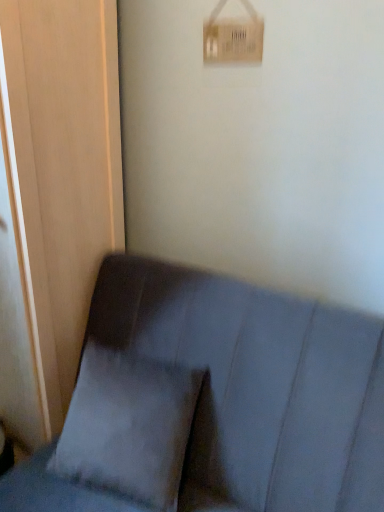
Image resolution: width=384 pixels, height=512 pixels. What do you see at coordinates (128, 426) in the screenshot?
I see `gray fabric pillow at lower left` at bounding box center [128, 426].

Where is `suede gray couch at lower left`? suede gray couch at lower left is located at coordinates (258, 386).

Identify the location of matte wood screen door at left. The height and width of the screenshot is (512, 384). (61, 170).

Image resolution: width=384 pixels, height=512 pixels. What do you see at coordinates (61, 170) in the screenshot? I see `matte wood screen door at left` at bounding box center [61, 170].

Identify the location of gray fabric pillow at lower left. (128, 426).

Is white cardboard light switch at upper center far away from matte wood screen door at left?

white cardboard light switch at upper center is actually quite close to matte wood screen door at left.

Identify the location of screen door below the white cardboard light switch at upper center (from the image's perspective). This screenshot has width=384, height=512. (61, 170).

Which object is closer to the camera, white cardboard light switch at upper center or matte wood screen door at left?

matte wood screen door at left is closer to the camera.

Does point (243, 35) come closer to viewer compared to point (24, 198)?

No, (243, 35) is further to viewer.

Is matte wood screen door at left wider than suede gray couch at lower left?

In fact, matte wood screen door at left might be narrower than suede gray couch at lower left.

Considering the sizes of objects matte wood screen door at left and suede gray couch at lower left in the image provided, who is taller, matte wood screen door at left or suede gray couch at lower left?

With more height is matte wood screen door at left.

Image resolution: width=384 pixels, height=512 pixels. In order to click on screen door above the suede gray couch at lower left (from a real-world perspective) in this screenshot , I will do `click(61, 170)`.

From the image's perspective, relative to suede gray couch at lower left, is matte wood screen door at left above or below?

matte wood screen door at left is above suede gray couch at lower left.

Is white cardboard light switch at upper center wider or thinner than gray fabric pillow at lower left?

In the image, white cardboard light switch at upper center appears to be more narrow than gray fabric pillow at lower left.

Is white cardboard light switch at upper center far away from gray fabric pillow at lower left?

white cardboard light switch at upper center is positioned a significant distance from gray fabric pillow at lower left.

How different are the orientations of white cardboard light switch at upper center and gray fabric pillow at lower left in degrees?

The angle between the facing direction of white cardboard light switch at upper center and the facing direction of gray fabric pillow at lower left is 0.552 degrees.

Does white cardboard light switch at upper center turn towards gray fabric pillow at lower left?

No, white cardboard light switch at upper center is not facing towards gray fabric pillow at lower left.

Is white cardboard light switch at upper center turned away from suede gray couch at lower left?

No, white cardboard light switch at upper center's orientation is not away from suede gray couch at lower left.

Between white cardboard light switch at upper center and suede gray couch at lower left, which one appears on the right side from the viewer's perspective?

white cardboard light switch at upper center.

Would you consider white cardboard light switch at upper center to be distant from suede gray couch at lower left?

No.

Is point (209, 30) closer to viewer compared to point (191, 312)?

No, (209, 30) is further to viewer.

Is gray fabric pillow at lower left far away from matte wood screen door at left?

That's not correct — gray fabric pillow at lower left is a little close to matte wood screen door at left.

Does gray fabric pillow at lower left contain matte wood screen door at left?

Definitely not — matte wood screen door at left is not inside gray fabric pillow at lower left.

From the image's perspective, is gray fabric pillow at lower left above or below matte wood screen door at left?

Based on their image positions, gray fabric pillow at lower left is located beneath matte wood screen door at left.

Considering the points (122, 365) and (89, 38), which point is behind, point (122, 365) or point (89, 38)?

Point (122, 365)

Who is shorter, matte wood screen door at left or gray fabric pillow at lower left?

gray fabric pillow at lower left.

Which of these two, matte wood screen door at left or gray fabric pillow at lower left, is smaller?

gray fabric pillow at lower left is smaller.

This screenshot has height=512, width=384. Identify the location of screen door on the left side of gray fabric pillow at lower left. (61, 170).

Are matte wood screen door at left and gray fabric pillow at lower left making contact?

No, matte wood screen door at left is not next to gray fabric pillow at lower left.

Is the surface of suede gray couch at lower left in direct contact with matte wood screen door at left?

suede gray couch at lower left and matte wood screen door at left are not in contact.

From the image's perspective, which object appears higher, suede gray couch at lower left or matte wood screen door at left?

matte wood screen door at left appears higher in the image.

Choose the correct answer: Is suede gray couch at lower left inside matte wood screen door at left or outside it?

suede gray couch at lower left cannot be found inside matte wood screen door at left.

Is suede gray couch at lower left facing towards matte wood screen door at left?

No, suede gray couch at lower left does not turn towards matte wood screen door at left.

Identify the location of screen door lying in front of the white cardboard light switch at upper center. This screenshot has width=384, height=512. (61, 170).

Image resolution: width=384 pixels, height=512 pixels. In order to click on furniture on the right of the matte wood screen door at left in this screenshot , I will do 258,386.

Consider the image. Which object lies nearer to the anchor point matte wood screen door at left, white cardboard light switch at upper center or suede gray couch at lower left?

Based on the image, suede gray couch at lower left appears to be nearer to matte wood screen door at left.

Based on their spatial positions, is gray fabric pillow at lower left or matte wood screen door at left further from suede gray couch at lower left?

Based on the image, matte wood screen door at left appears to be further to suede gray couch at lower left.

Which object lies nearer to the anchor point matte wood screen door at left, gray fabric pillow at lower left or suede gray couch at lower left?

gray fabric pillow at lower left lies closer to matte wood screen door at left than the other object.

Based on their spatial positions, is matte wood screen door at left or white cardboard light switch at upper center closer to suede gray couch at lower left?

matte wood screen door at left lies closer to suede gray couch at lower left than the other object.

When comparing their distances from matte wood screen door at left, does suede gray couch at lower left or gray fabric pillow at lower left seem closer?

The object closer to matte wood screen door at left is gray fabric pillow at lower left.

In the scene shown: When comparing their distances from white cardboard light switch at upper center, does gray fabric pillow at lower left or matte wood screen door at left seem closer?

matte wood screen door at left.

Looking at the image, which one is located closer to white cardboard light switch at upper center, gray fabric pillow at lower left or suede gray couch at lower left?

Among the two, suede gray couch at lower left is located nearer to white cardboard light switch at upper center.

From the image, which object appears to be farther from suede gray couch at lower left, gray fabric pillow at lower left or white cardboard light switch at upper center?

white cardboard light switch at upper center.

I want to click on pillow located between matte wood screen door at left and suede gray couch at lower left in the left-right direction, so [128, 426].

Identify the location of screen door between white cardboard light switch at upper center and gray fabric pillow at lower left from top to bottom. (x=61, y=170).

The height and width of the screenshot is (512, 384). In order to click on pillow between white cardboard light switch at upper center and suede gray couch at lower left vertically in this screenshot , I will do `click(128, 426)`.

You are a GUI agent. You are given a task and a screenshot of the screen. Output one action in this format:
    pyautogui.click(x=<x>, y=<y>)
    Task: Click on the screen door between white cardboard light switch at upper center and suede gray couch at lower left from top to bottom
    Image resolution: width=384 pixels, height=512 pixels.
    Given the screenshot: What is the action you would take?
    pyautogui.click(x=61, y=170)